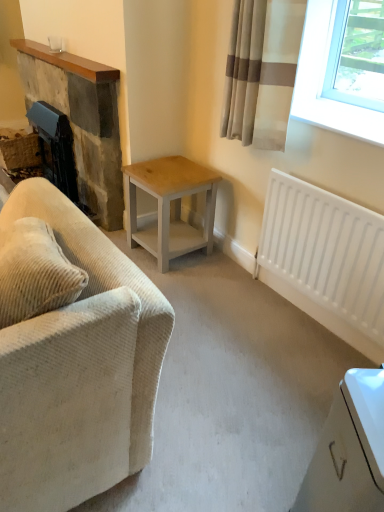
Locate an element on the screen. free space between light wood/grey painted table at center and white matte radiator at lower right is located at coordinates [246, 297].